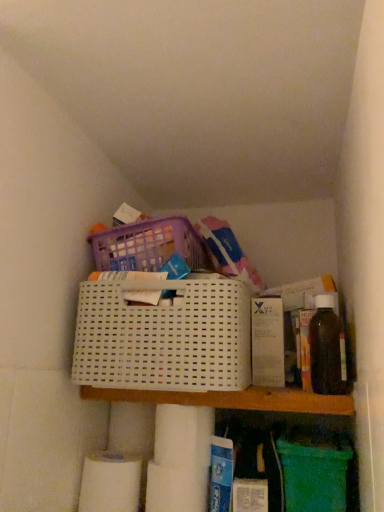
Question: Is the position of translucent amber bottle at right less distant than that of white plastic shelf at center?

Choices:
 (A) yes
 (B) no

Answer: (B)

Question: Considering the relative sizes of translucent amber bottle at right and white plastic shelf at center in the image provided, is translucent amber bottle at right shorter than white plastic shelf at center?

Choices:
 (A) yes
 (B) no

Answer: (B)

Question: Does translucent amber bottle at right have a greater width compared to white plastic shelf at center?

Choices:
 (A) no
 (B) yes

Answer: (A)

Question: Is translucent amber bottle at right taller than white plastic shelf at center?

Choices:
 (A) no
 (B) yes

Answer: (B)

Question: Is translucent amber bottle at right outside white plastic shelf at center?

Choices:
 (A) no
 (B) yes

Answer: (B)

Question: From the image's perspective, is white matte toilet paper at lower center, which appears as the 1th toilet paper when viewed from the top, located above or below white plastic basket at center?

Choices:
 (A) above
 (B) below

Answer: (B)

Question: Is white matte toilet paper at lower center, which appears as the 1th toilet paper when viewed from the top, bigger or smaller than white plastic basket at center?

Choices:
 (A) small
 (B) big

Answer: (A)

Question: Considering their positions, is white matte toilet paper at lower center, the second toilet paper ordered from the bottom, located in front of or behind white plastic basket at center?

Choices:
 (A) front
 (B) behind

Answer: (B)

Question: Is point (165, 461) positioned closer to the camera than point (130, 333)?

Choices:
 (A) farther
 (B) closer

Answer: (A)

Question: Based on their sizes in the image, would you say white matte toilet paper at lower left, which appears as the 2th toilet paper when viewed from the right, is bigger or smaller than translucent amber bottle at right?

Choices:
 (A) small
 (B) big

Answer: (A)

Question: From a real-world perspective, is white matte toilet paper at lower left, placed as the 1th toilet paper when sorted from left to right, above or below translucent amber bottle at right?

Choices:
 (A) below
 (B) above

Answer: (A)

Question: From the image's perspective, relative to translucent amber bottle at right, is white matte toilet paper at lower left, the 2th toilet paper in the top-to-bottom sequence, above or below?

Choices:
 (A) below
 (B) above

Answer: (A)

Question: Is white matte toilet paper at lower left, the 2th toilet paper in the top-to-bottom sequence, in front of or behind translucent amber bottle at right in the image?

Choices:
 (A) behind
 (B) front

Answer: (A)

Question: In the image, is white matte toilet paper at lower center, the second toilet paper ordered from the bottom, positioned in front of or behind white matte toilet paper at lower left, the 2th toilet paper in the top-to-bottom sequence?

Choices:
 (A) front
 (B) behind

Answer: (A)

Question: Is white matte toilet paper at lower center, placed as the first toilet paper when sorted from right to left, situated inside white matte toilet paper at lower left, the 1th toilet paper ordered from the bottom, or outside?

Choices:
 (A) inside
 (B) outside

Answer: (B)